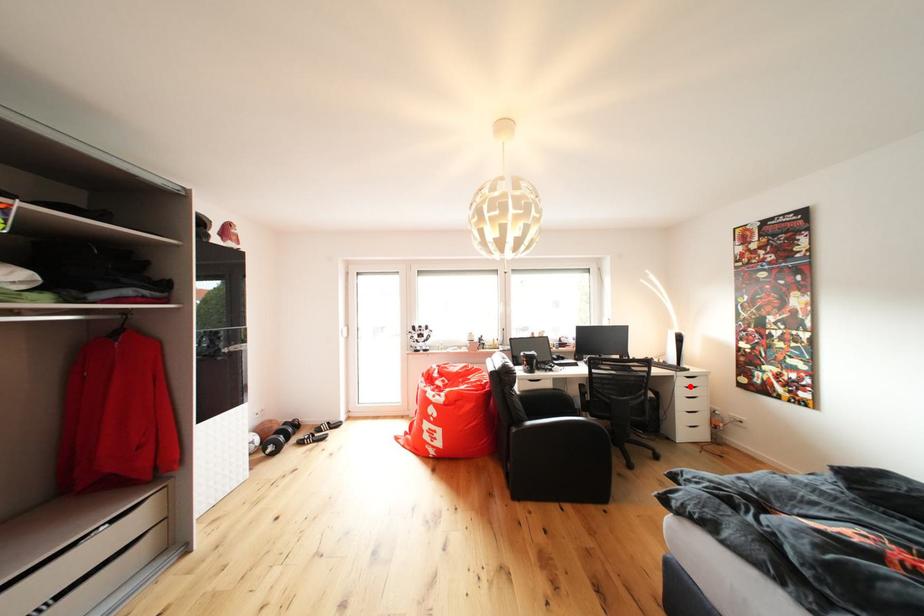
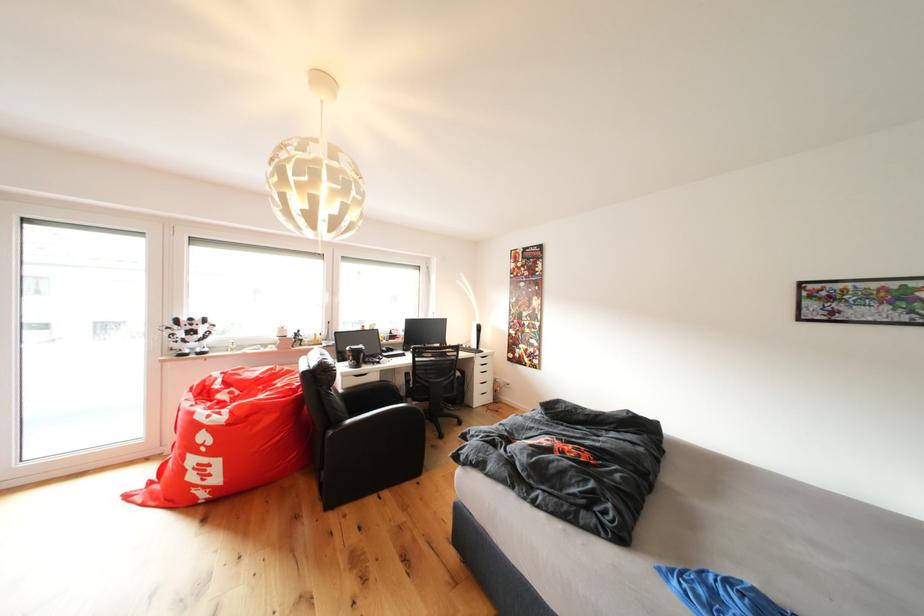
Find the pixel in the second image that matches the highlighted location in the first image.

(487, 366)